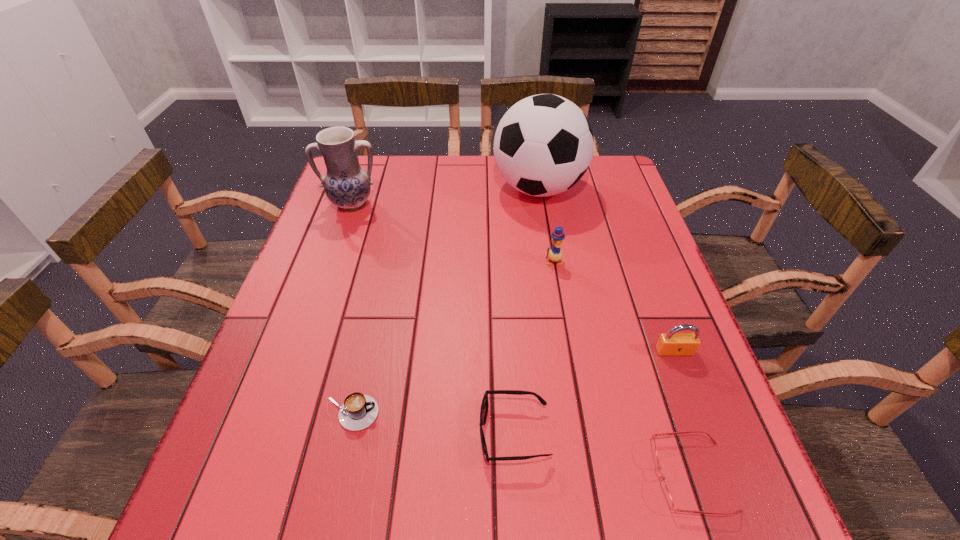
Image resolution: width=960 pixels, height=540 pixels. I want to click on soccer ball present at the far edge, so click(x=543, y=145).

Locate an element on the screen. The width and height of the screenshot is (960, 540). pottery present at the far edge is located at coordinates (347, 185).

Identify the location of object that is positioned at the near edge. (666, 494).

Find the location of `pottery at the left edge`. pottery at the left edge is located at coordinates (347, 185).

Image resolution: width=960 pixels, height=540 pixels. Find the location of `cappuccino situated at the left edge`. cappuccino situated at the left edge is located at coordinates (359, 411).

Locate an element on the screen. This screenshot has height=540, width=960. soccer ball present at the right edge is located at coordinates (543, 145).

At what (x,y) coordinates should I click in order to perform the action: click on padlock that is positioned at the right edge. Please return your answer as a coordinate pair (x, y). This screenshot has width=960, height=540. Looking at the image, I should click on (672, 343).

The width and height of the screenshot is (960, 540). Identify the location of spectacles situated at the right edge. (666, 494).

At what (x,y) coordinates should I click in order to perform the action: click on object at the far left corner. Please return your answer as a coordinate pair (x, y). Looking at the image, I should click on (347, 185).

This screenshot has width=960, height=540. I want to click on object that is at the far right corner, so click(543, 145).